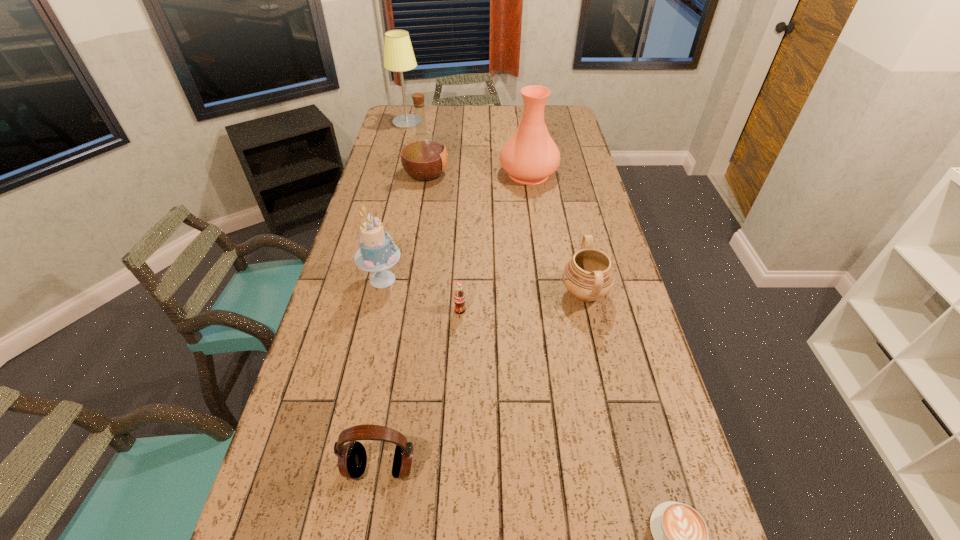
Identify the location of vacant space located on the front label of the liquor. (499, 173).

Locate an element on the screen. Image resolution: width=960 pixels, height=540 pixels. vacant space located 0.260m with a ladder on the side of the fourth tallest object is located at coordinates (485, 279).

This screenshot has width=960, height=540. What are the coordinates of `free space located 0.350m on the front-facing side of the urn` in the screenshot? It's located at (446, 293).

Locate an element on the screen. Image resolution: width=960 pixels, height=540 pixels. vacant space situated 0.050m on the front-facing side of the urn is located at coordinates (543, 293).

Find the location of a particular element. The image size is (960, 540). vacant point located on the front-facing side of the urn is located at coordinates point(446,293).

Where is `vacant space located 0.160m on the front of the soda`? vacant space located 0.160m on the front of the soda is located at coordinates coord(458,360).

Locate an element on the screen. This screenshot has height=540, width=960. object present at the far edge is located at coordinates (398, 53).

The image size is (960, 540). In order to click on table lamp at the left edge in this screenshot , I will do `click(398, 53)`.

I want to click on liquor at the left edge, so click(x=424, y=157).

What are the coordinates of `cake that is at the left edge` in the screenshot? It's located at (378, 252).